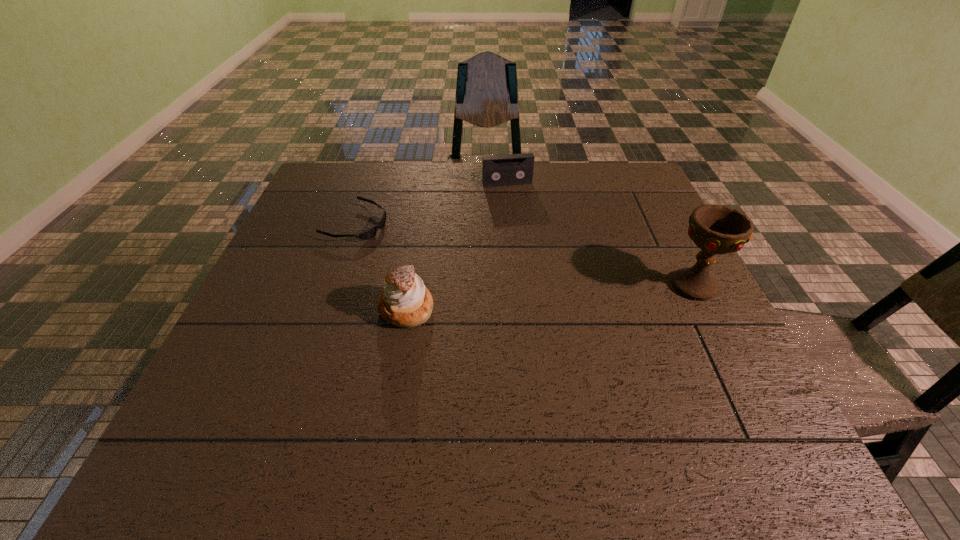
Find the location of a particular element. vacant region at the near edge of the desktop is located at coordinates (518, 382).

In the image, there is a desktop. Where is `vacant space at the left edge`? The width and height of the screenshot is (960, 540). vacant space at the left edge is located at coordinates (326, 215).

This screenshot has height=540, width=960. In the image, there is a desktop. What are the coordinates of `free space at the right edge` in the screenshot? It's located at (707, 363).

In the image, there is a desktop. Find the location of `free space at the far left corner`. free space at the far left corner is located at coordinates (360, 191).

In order to click on vacant position at the far right corner of the desktop in this screenshot , I will do `click(602, 163)`.

Find the location of a particular element. The width and height of the screenshot is (960, 540). free space between the shortest object and the chalice is located at coordinates (524, 254).

Find the location of `unoccupied area between the sunglasses and the second shortest object`. unoccupied area between the sunglasses and the second shortest object is located at coordinates (431, 204).

Locate an element on the screen. This screenshot has height=540, width=960. free area in between the leftmost object and the chalice is located at coordinates (524, 254).

The height and width of the screenshot is (540, 960). I want to click on unoccupied area between the farthest object and the second farthest object, so click(x=431, y=204).

The width and height of the screenshot is (960, 540). Find the location of `vacant point located between the chalice and the farthest object`. vacant point located between the chalice and the farthest object is located at coordinates (600, 234).